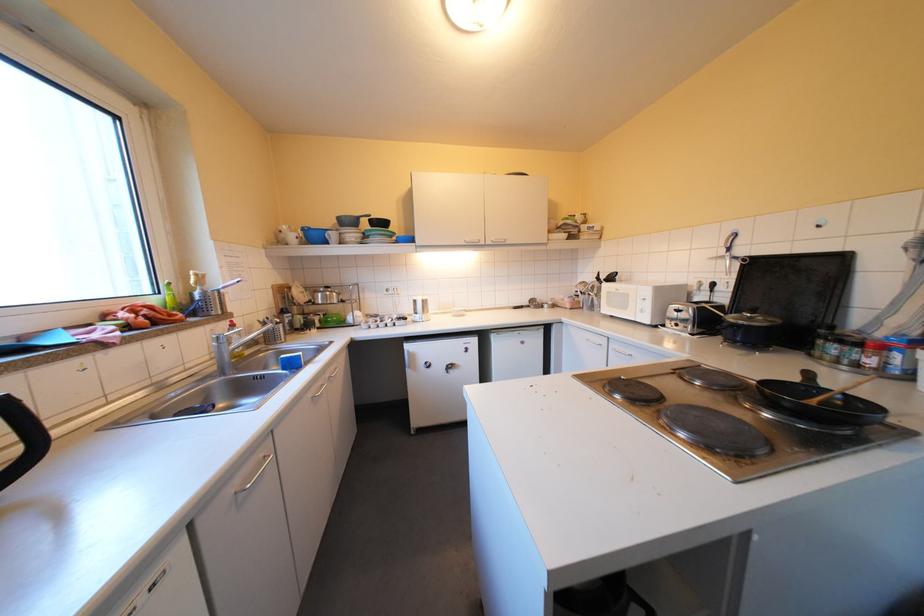
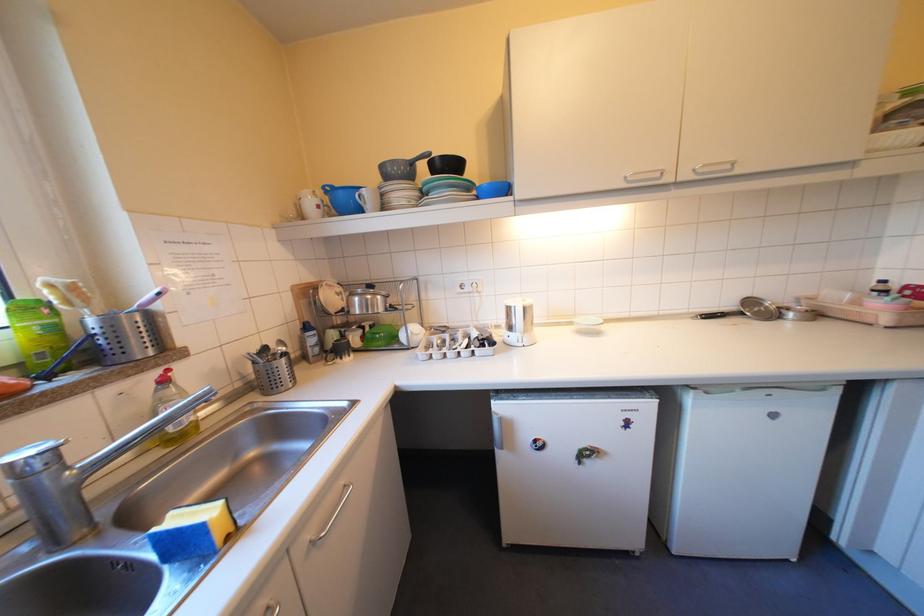
Find the pixel in the second image that matches (341,241) in the first image.

(373, 209)